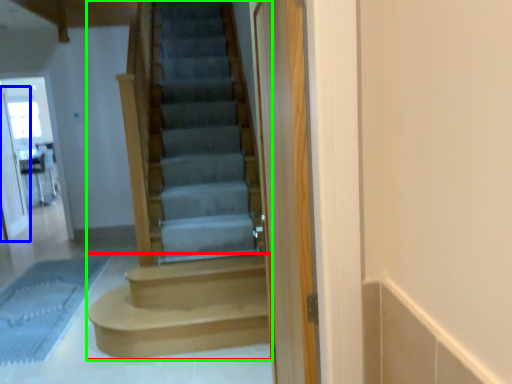
Question: Estimate the real-world distances between objects in this image. Which object is closer to stairs (highlighted by a red box), screen door (highlighted by a blue box) or stairs (highlighted by a green box)?

Choices:
 (A) screen door
 (B) stairs

Answer: (B)